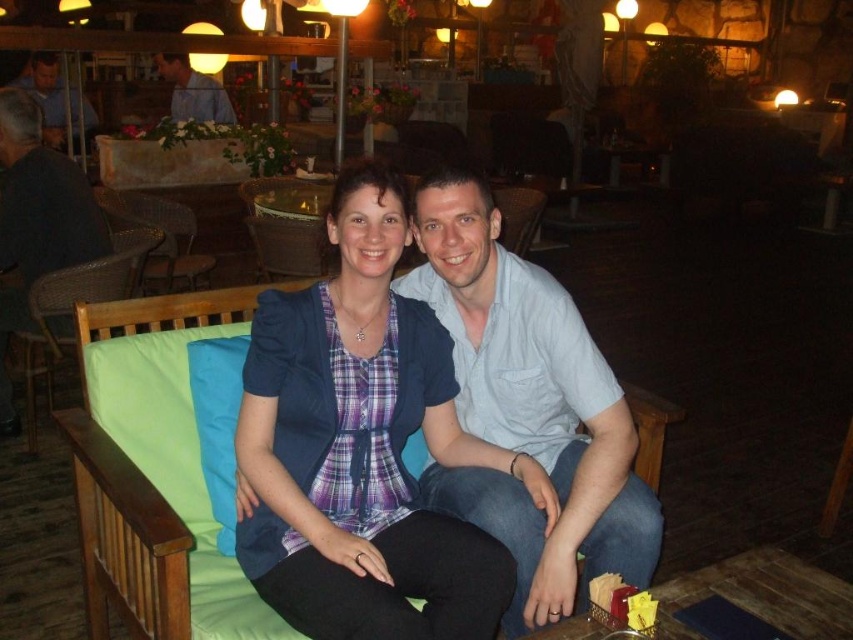
Is matte blue shirt at upper left above blue shirt at upper left?

No, matte blue shirt at upper left is not above blue shirt at upper left.

You are a GUI agent. You are given a task and a screenshot of the screen. Output one action in this format:
    pyautogui.click(x=<x>, y=<y>)
    Task: Click on the matte blue shirt at upper left
    The height and width of the screenshot is (640, 853).
    Given the screenshot: What is the action you would take?
    [x=56, y=100]

Does blue fabric pillow at center have a greater height compared to matte blue shirt at upper left?

Incorrect, blue fabric pillow at center's height is not larger of matte blue shirt at upper left's.

Between point (210, 358) and point (51, 67), which one is positioned behind?

Positioned behind is point (51, 67).

Find the location of a particular element. This screenshot has height=640, width=853. blue fabric pillow at center is located at coordinates (218, 422).

Does plaid fabric shirt at center lie behind matte blue shirt at upper left?

No, plaid fabric shirt at center is in front of matte blue shirt at upper left.

Is plaid fabric shirt at center to the right of matte blue shirt at upper left from the viewer's perspective?

Correct, you'll find plaid fabric shirt at center to the right of matte blue shirt at upper left.

Who is more distant from viewer, (264, 349) or (90, 118)?

The point (90, 118) is more distant.

Where is `plaid fabric shirt at center`? Image resolution: width=853 pixels, height=640 pixels. plaid fabric shirt at center is located at coordinates (367, 445).